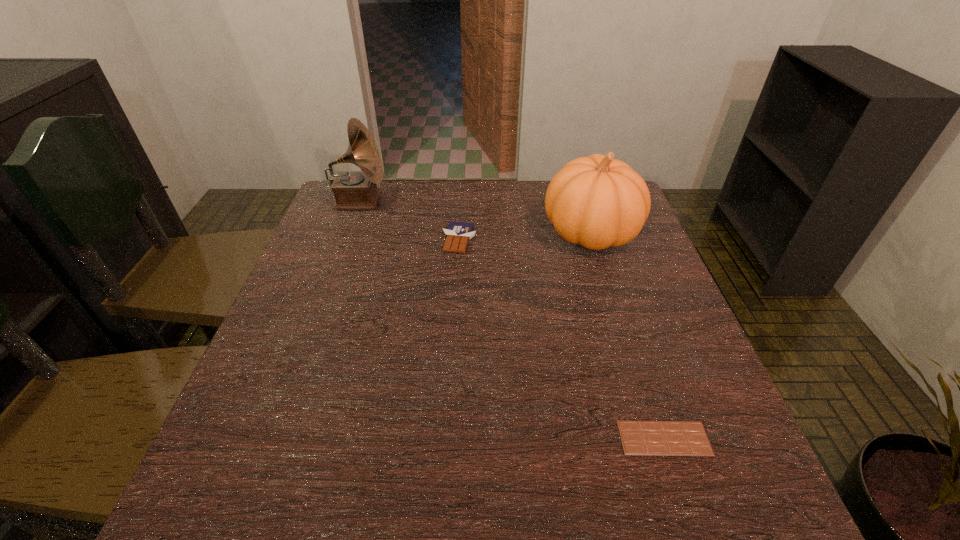
Where is `free space at the left edge of the desktop`? The height and width of the screenshot is (540, 960). free space at the left edge of the desktop is located at coordinates (291, 372).

In order to click on vacant space at the right edge in this screenshot , I will do `click(652, 246)`.

Locate an element on the screen. free space at the far left corner is located at coordinates (385, 197).

This screenshot has height=540, width=960. I want to click on vacant region between the leftmost object and the nearest object, so click(512, 320).

You are a GUI agent. You are given a task and a screenshot of the screen. Output one action in this format:
    pyautogui.click(x=<x>, y=<y>)
    Task: Click on the free space between the nearer chocolate bar and the phonograph record
    This screenshot has height=540, width=960.
    Given the screenshot: What is the action you would take?
    pyautogui.click(x=512, y=320)

At what (x,y) coordinates should I click in order to perform the action: click on empty space that is in between the pumpkin and the phonograph record. Please return your answer as a coordinate pair (x, y). The height and width of the screenshot is (540, 960). Looking at the image, I should click on (475, 217).

I want to click on free spot between the second shortest object and the nearest object, so click(562, 339).

At what (x,y) coordinates should I click in order to perform the action: click on vacant region between the phonograph record and the shorter chocolate bar. Please return your answer as a coordinate pair (x, y). The width and height of the screenshot is (960, 540). Looking at the image, I should click on (512, 320).

You are a GUI agent. You are given a task and a screenshot of the screen. Output one action in this format:
    pyautogui.click(x=<x>, y=<y>)
    Task: Click on the empty space between the right chocolate bar and the taller chocolate bar
    The height and width of the screenshot is (540, 960).
    Given the screenshot: What is the action you would take?
    pyautogui.click(x=562, y=339)

You are a GUI agent. You are given a task and a screenshot of the screen. Output one action in this format:
    pyautogui.click(x=<x>, y=<y>)
    Task: Click on the vacant space that's between the nearer chocolate bar and the phonograph record
    
    Given the screenshot: What is the action you would take?
    pyautogui.click(x=512, y=320)